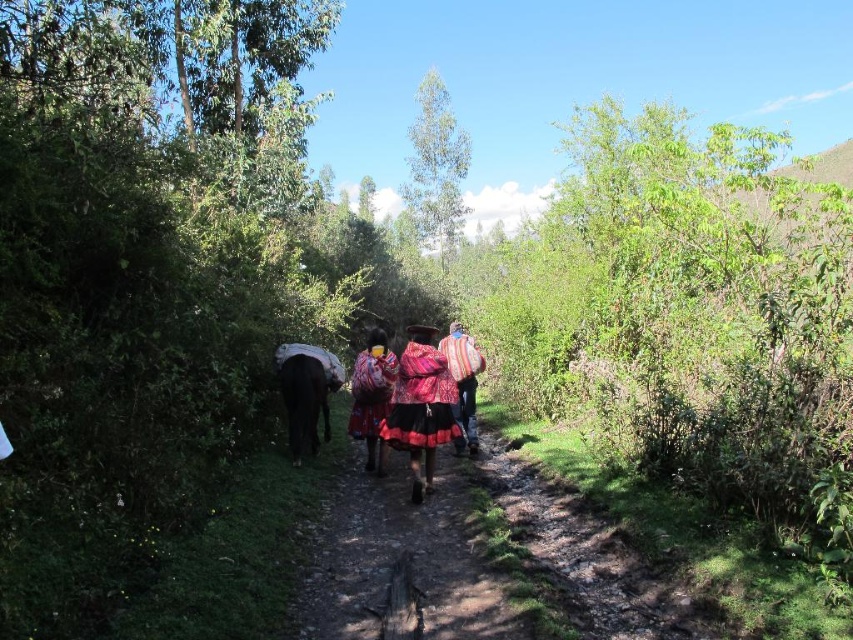
Does multicolored woven skirt at center lie in front of textured woolen shawl at center?

That is True.

Describe the element at coordinates (421, 406) in the screenshot. The width and height of the screenshot is (853, 640). I see `multicolored woven skirt at center` at that location.

This screenshot has height=640, width=853. I want to click on multicolored woven skirt at center, so click(x=421, y=406).

Can you confirm if multicolored woven skirt at center is positioned to the right of multicolored woven shawl at center?

Indeed, multicolored woven skirt at center is positioned on the right side of multicolored woven shawl at center.

Is point (401, 406) closer to viewer compared to point (386, 380)?

Yes, point (401, 406) is closer to viewer.

Describe the element at coordinates (421, 406) in the screenshot. I see `multicolored woven skirt at center` at that location.

You are a GUI agent. You are given a task and a screenshot of the screen. Output one action in this format:
    pyautogui.click(x=<x>, y=<y>)
    Task: Click on the multicolored woven skirt at center
    The image size is (853, 640).
    Given the screenshot: What is the action you would take?
    pyautogui.click(x=421, y=406)

In the scene shown: Is dusty brown dirt path at center above textured woolen shawl at center?

Incorrect, dusty brown dirt path at center is not positioned above textured woolen shawl at center.

Can you confirm if dusty brown dirt path at center is positioned below textured woolen shawl at center?

Indeed, dusty brown dirt path at center is positioned under textured woolen shawl at center.

The width and height of the screenshot is (853, 640). What do you see at coordinates (480, 563) in the screenshot? I see `dusty brown dirt path at center` at bounding box center [480, 563].

The height and width of the screenshot is (640, 853). What are the coordinates of `dusty brown dirt path at center` in the screenshot? It's located at (480, 563).